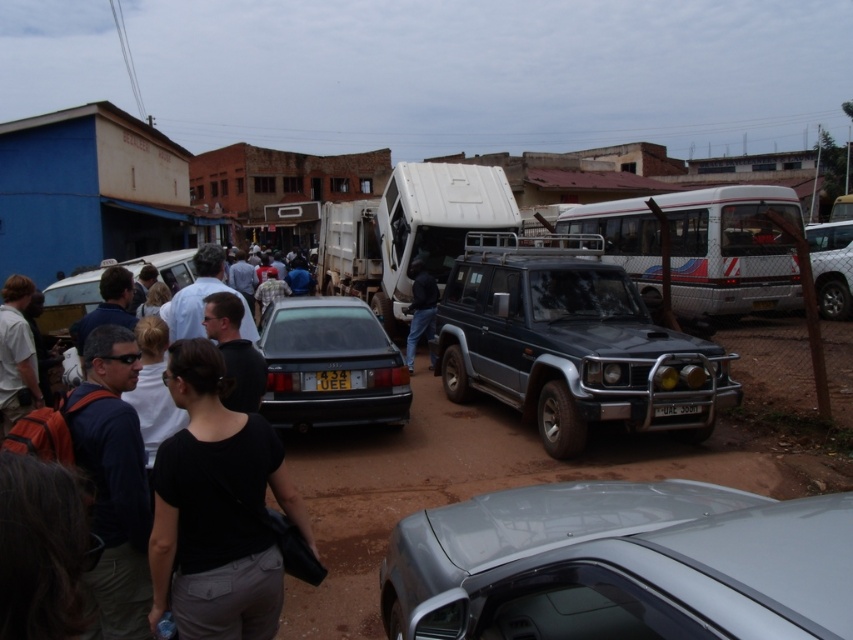
You are a delivery person trying to park your motorcycle between the metallic blue suv at center and the yellow matte license plate at center. The motorcycle is 1.2 meters wide. Can you fit your motorcycle in that space?

The metallic blue suv at center might be wider than yellow matte license plate at center, so the space between them may not be sufficient for the motorcycle which is 1.2 meters wide. It is uncertain whether it will fit without more precise measurements.

You are a fashion designer observing the scene. You notice the black fabric shirt at center and dark blue jeans at center. Which clothing item is wider?

The black fabric shirt at center is wider than the dark blue jeans at center.

You are a fashion designer observing a person wearing a black fabric shirt at center and dark blue jeans at center. Which clothing item appears smaller in size?

The black fabric shirt at center has a smaller size compared to the dark blue jeans at center.